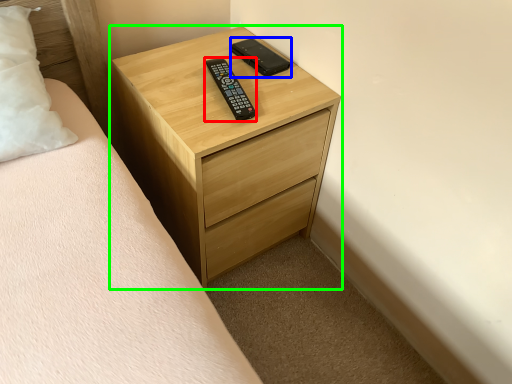
Question: Estimate the real-world distances between objects in this image. Which object is farther from control (highlighted by a red box), control (highlighted by a blue box) or chest of drawers (highlighted by a green box)?

Choices:
 (A) control
 (B) chest of drawers

Answer: (B)